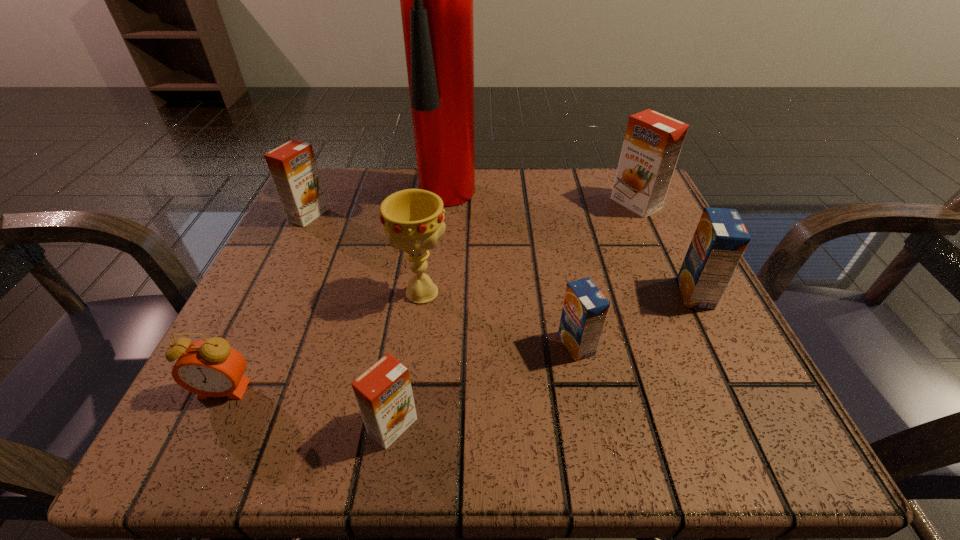
This screenshot has height=540, width=960. Identify the location of red fire extinguisher. (436, 0).

Where is `the tallest object`? the tallest object is located at coordinates (436, 0).

The width and height of the screenshot is (960, 540). I want to click on the biggest orange orange juice, so click(652, 143).

You are a GUI agent. You are given a task and a screenshot of the screen. Output one action in this format:
    pyautogui.click(x=<x>, y=<y>)
    Task: Click on the rightmost orange orange juice
    
    Given the screenshot: What is the action you would take?
    pyautogui.click(x=652, y=143)

Where is `chalice`? The width and height of the screenshot is (960, 540). chalice is located at coordinates (412, 219).

Find the location of a particular element. the second biggest orange orange juice is located at coordinates (293, 168).

Identify the location of the leftmost orange juice. (293, 168).

At what (x,y) coordinates should I click in order to perform the action: click on the third nearest orange juice. Please return your answer as a coordinate pair (x, y). This screenshot has width=960, height=540. Looking at the image, I should click on (720, 239).

Find the location of a particular element. the right blue orange_juice is located at coordinates (720, 239).

Where is `alarm clock`? This screenshot has width=960, height=540. alarm clock is located at coordinates (211, 368).